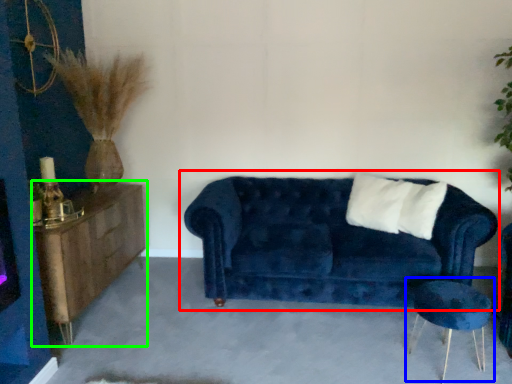
Question: Based on their relative distances, which object is farther from studio couch (highlighted by a red box)? Choose from side table (highlighted by a blue box) and dresser (highlighted by a green box).

Choices:
 (A) side table
 (B) dresser

Answer: (B)